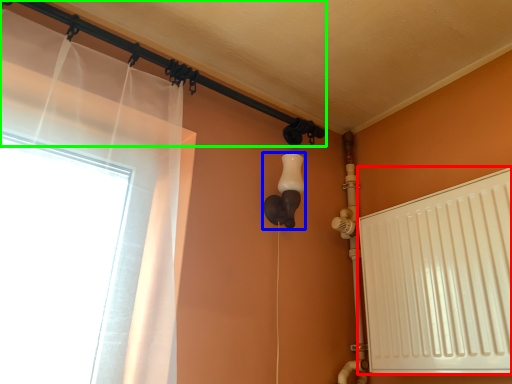
Question: Estimate the real-world distances between objects in this image. Which object is closer to radiator (highlighted by a red box), light fixture (highlighted by a blue box) or pipe (highlighted by a green box)?

Choices:
 (A) light fixture
 (B) pipe

Answer: (A)